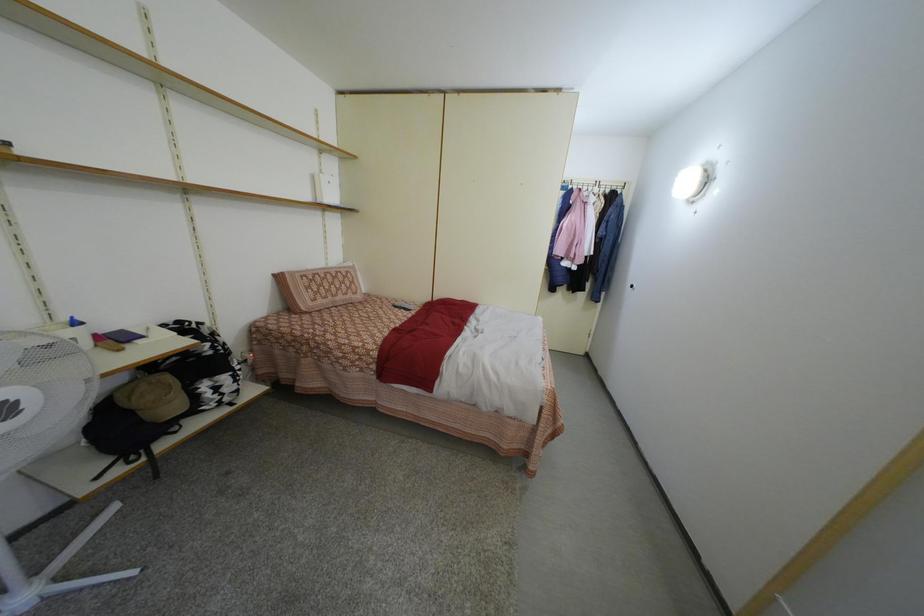
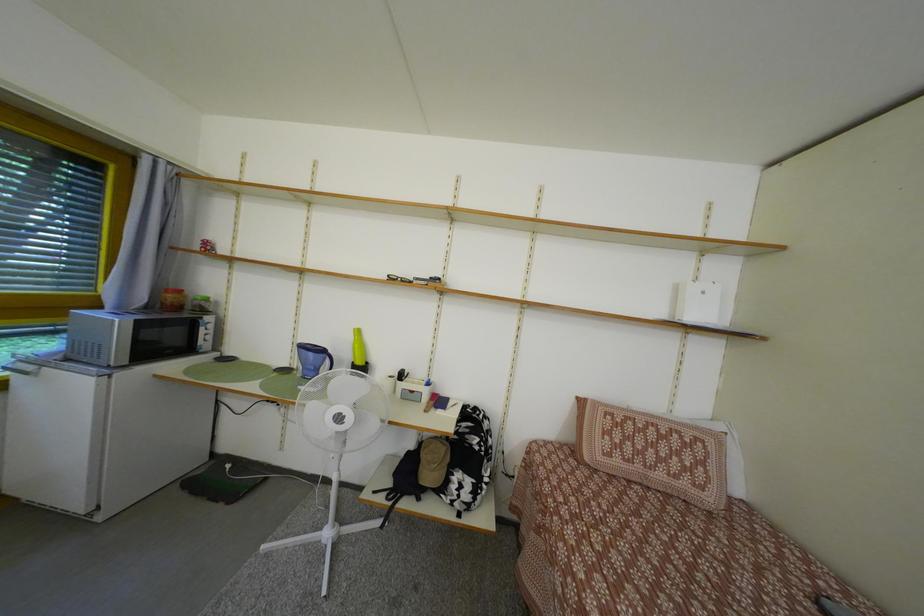
Question: The camera is either moving clockwise (left) or counter-clockwise (right) around the object. The first image is from the beginning of the video and the second image is from the end. Is the camera moving left or right when shooting the video?

Choices:
 (A) Left
 (B) Right

Answer: (B)